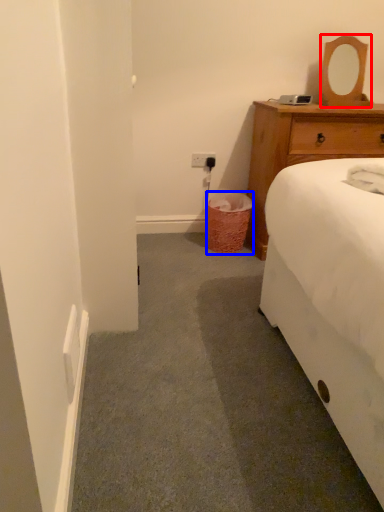
Question: Which object appears closest to the camera in this image, mirror (highlighted by a red box) or trash bin/can (highlighted by a blue box)?

Choices:
 (A) mirror
 (B) trash bin/can

Answer: (A)